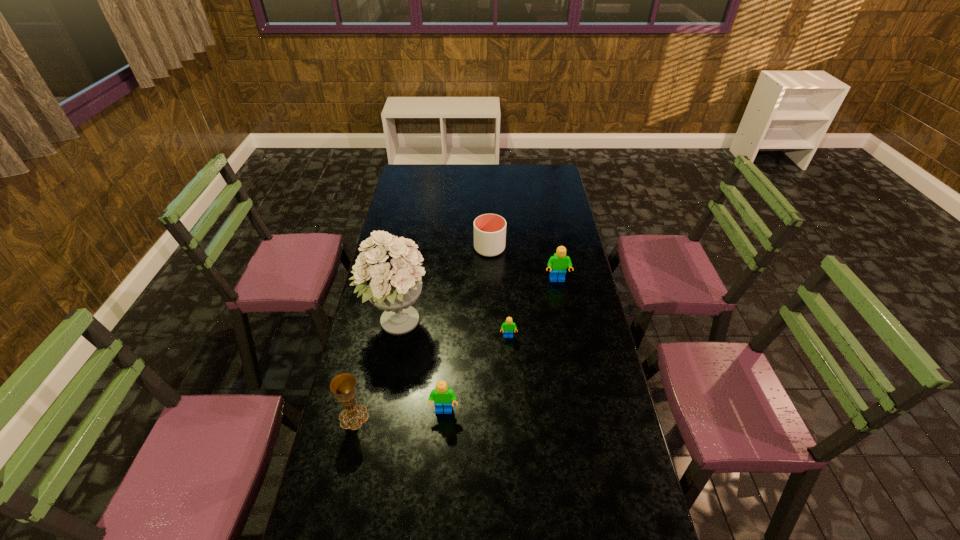
At what (x,y) coordinates should I click in order to perform the action: click on the nearest Lego. Please return your answer as a coordinate pair (x, y). Looking at the image, I should click on (442, 395).

Find the location of a particular element. Image resolution: width=960 pixels, height=540 pixels. the leftmost Lego is located at coordinates (442, 395).

Locate an element on the screen. the second Lego from right to left is located at coordinates (508, 326).

Identify the location of the second farthest Lego. (508, 326).

Identify the location of the second farthest object. Image resolution: width=960 pixels, height=540 pixels. (558, 263).

Where is `the rightmost object`? the rightmost object is located at coordinates (558, 263).

You are a GUI agent. You are given a task and a screenshot of the screen. Output one action in this format:
    pyautogui.click(x=<x>, y=<y>)
    Task: Click on the cup
    
    Given the screenshot: What is the action you would take?
    pyautogui.click(x=489, y=229)

You are a GUI agent. You are given a task and a screenshot of the screen. Output one action in this format:
    pyautogui.click(x=<x>, y=<y>)
    Task: Click on the bouquet
    This screenshot has height=540, width=960.
    Given the screenshot: What is the action you would take?
    pyautogui.click(x=390, y=275)

Locate an element on the screen. The width and height of the screenshot is (960, 540). chalice is located at coordinates (343, 385).

Where is `vacant region located on the face of the third object from left to right`? Image resolution: width=960 pixels, height=540 pixels. vacant region located on the face of the third object from left to right is located at coordinates (441, 461).